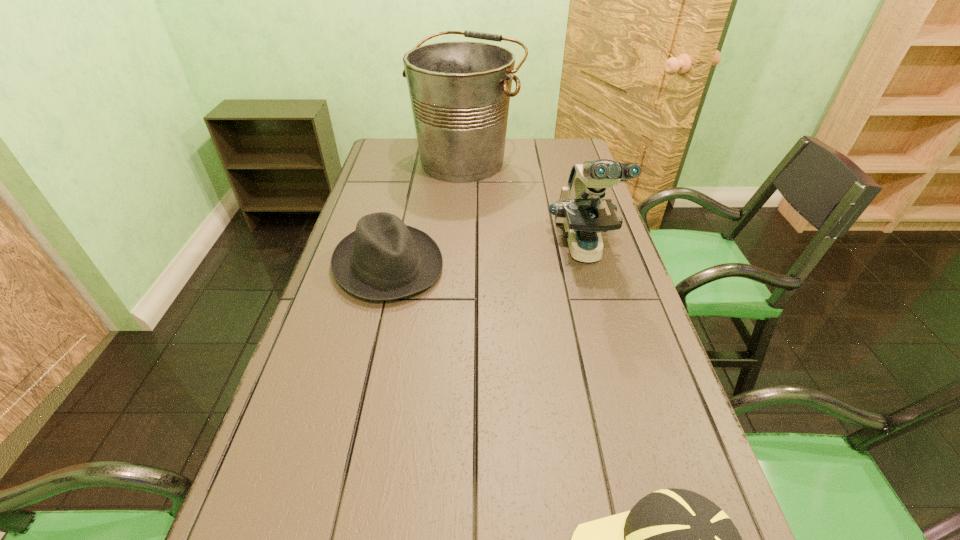
Find the location of a particular element. The height and width of the screenshot is (540, 960). object present at the right edge is located at coordinates (581, 209).

This screenshot has height=540, width=960. What are the coordinates of `object that is at the far left corner` in the screenshot? It's located at (460, 91).

In the image, there is a desktop. Identify the location of free space at the far edge. (514, 149).

This screenshot has width=960, height=540. In the image, there is a desktop. What are the coordinates of `vacant area at the left edge` in the screenshot? It's located at (372, 199).

Image resolution: width=960 pixels, height=540 pixels. I want to click on free location at the right edge of the desktop, so tap(550, 173).

I want to click on blank space at the far left corner of the desktop, so click(x=412, y=155).

Locate an element on the screen. This screenshot has height=540, width=960. vacant space that's between the bucket and the fedora is located at coordinates (427, 213).

Where is `unoccupied position between the microscope and the fedora`? unoccupied position between the microscope and the fedora is located at coordinates (486, 257).

Locate an element on the screen. This screenshot has width=960, height=540. free spot between the tallest object and the fedora is located at coordinates (427, 213).

Locate an element on the screen. This screenshot has width=960, height=540. free point between the microscope and the bucket is located at coordinates pyautogui.click(x=524, y=205).